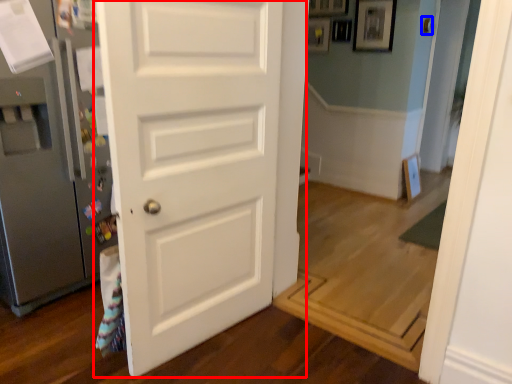
Question: Which of the following is the farthest to the observer, door (highlighted by a red box) or door handle (highlighted by a blue box)?

Choices:
 (A) door
 (B) door handle

Answer: (B)